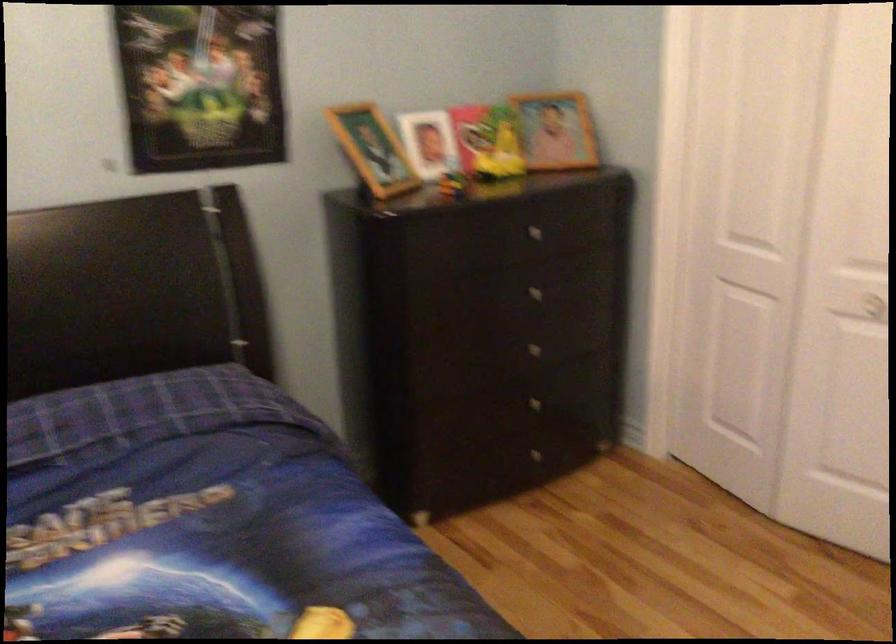
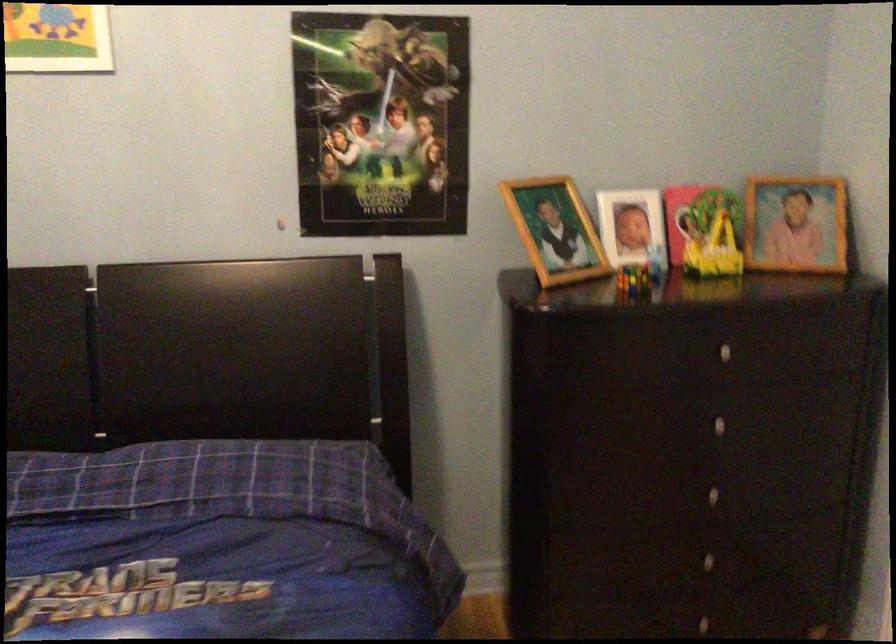
Where in the second image is the point corresponding to point 501,145 from the first image?

(719, 240)